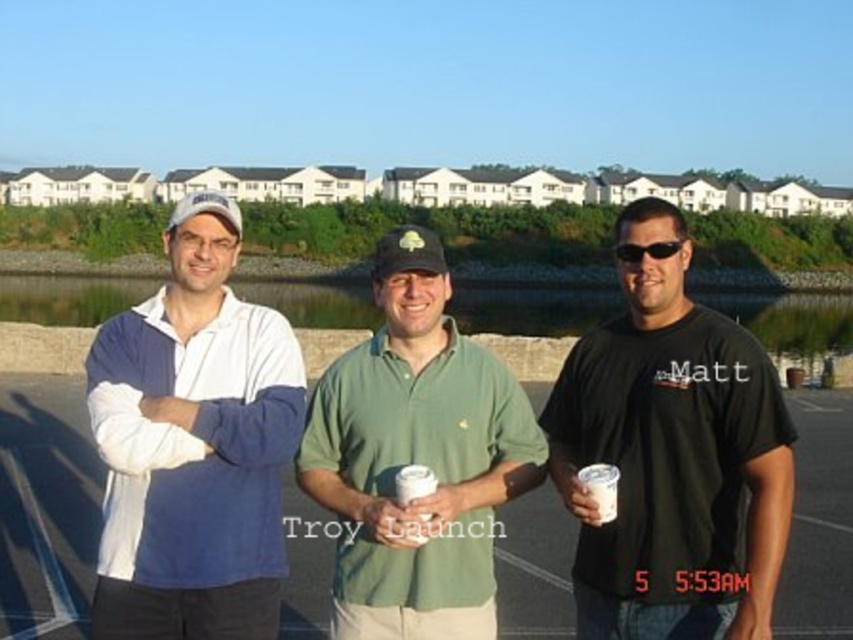
Question: Does black matte t-shirt at center have a larger size compared to sunglasses at center?

Choices:
 (A) no
 (B) yes

Answer: (B)

Question: Among these objects, which one is farthest from the camera?

Choices:
 (A) green cotton polo shirt at center
 (B) sunglasses at center
 (C) black matte t-shirt at center

Answer: (B)

Question: Can you confirm if white cotton polo shirt at left is positioned above green cotton polo shirt at center?

Choices:
 (A) yes
 (B) no

Answer: (A)

Question: From the image, what is the correct spatial relationship of black matte t-shirt at center in relation to white cotton polo shirt at left?

Choices:
 (A) below
 (B) above

Answer: (A)

Question: Among these objects, which one is farthest from the camera?

Choices:
 (A) white paper cup at center
 (B) black matte t-shirt at center
 (C) sunglasses at center
 (D) white cotton polo shirt at left

Answer: (C)

Question: Which object appears farthest from the camera in this image?

Choices:
 (A) sunglasses at center
 (B) white cotton polo shirt at left

Answer: (A)